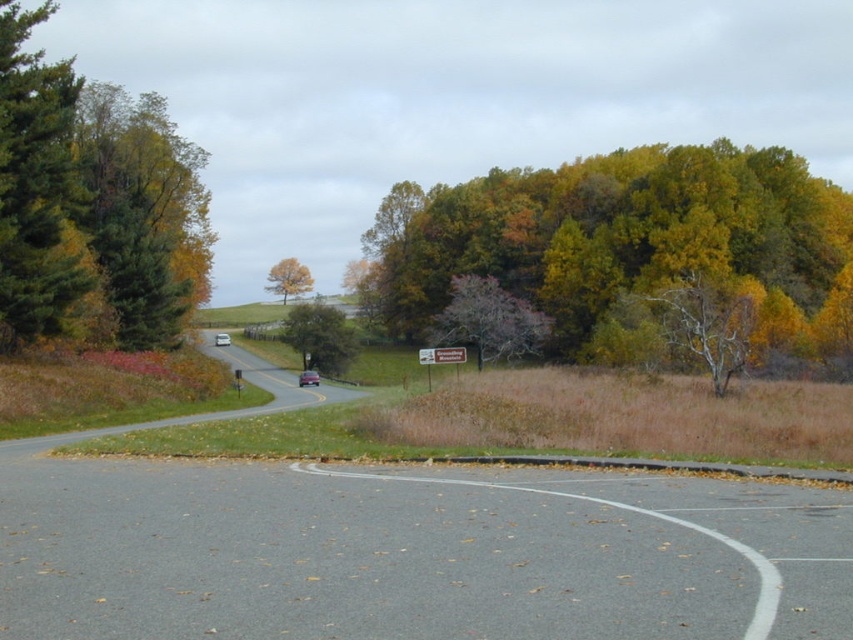
Is wooden sign at center bigger than metallic silver sedan at center?

Yes, wooden sign at center is bigger than metallic silver sedan at center.

Is point (457, 353) positioned before point (300, 387)?

That is True.

The width and height of the screenshot is (853, 640). Identify the location of wooden sign at center. (440, 355).

Is green matte tree at center taller than yellow matte tree at upper center?

Incorrect, green matte tree at center's height is not larger of yellow matte tree at upper center's.

Does green matte tree at center appear under yellow matte tree at upper center?

Indeed, green matte tree at center is positioned under yellow matte tree at upper center.

Is point (329, 339) positioned in front of point (285, 268)?

Yes, point (329, 339) is in front of point (285, 268).

The height and width of the screenshot is (640, 853). I want to click on green matte tree at center, so click(320, 337).

Between yellow-green foliage at upper right and metallic silver sedan at center, which one is positioned higher?

Positioned higher is yellow-green foliage at upper right.

Does yellow-green foliage at upper right lie in front of metallic silver sedan at center?

Yes, it is in front of metallic silver sedan at center.

Find the location of a particular element. yellow-green foliage at upper right is located at coordinates (608, 236).